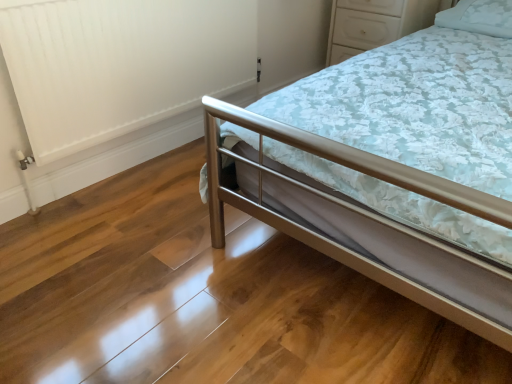
Question: Considering the relative sizes of white glossy dresser at upper right and metallic silver bed at center in the image provided, is white glossy dresser at upper right bigger than metallic silver bed at center?

Choices:
 (A) yes
 (B) no

Answer: (B)

Question: From a real-world perspective, is white glossy dresser at upper right under metallic silver bed at center?

Choices:
 (A) yes
 (B) no

Answer: (A)

Question: Is white glossy dresser at upper right not inside metallic silver bed at center?

Choices:
 (A) yes
 (B) no

Answer: (A)

Question: Is white glossy dresser at upper right aimed at metallic silver bed at center?

Choices:
 (A) yes
 (B) no

Answer: (B)

Question: Considering the relative sizes of white glossy dresser at upper right and metallic silver bed at center in the image provided, is white glossy dresser at upper right wider than metallic silver bed at center?

Choices:
 (A) yes
 (B) no

Answer: (B)

Question: Is white glossy dresser at upper right thinner than metallic silver bed at center?

Choices:
 (A) no
 (B) yes

Answer: (B)

Question: From a real-world perspective, is white matte radiator at left on metallic silver bed at center?

Choices:
 (A) no
 (B) yes

Answer: (A)

Question: Is white matte radiator at left positioned behind metallic silver bed at center?

Choices:
 (A) yes
 (B) no

Answer: (A)

Question: Considering the relative sizes of white matte radiator at left and metallic silver bed at center in the image provided, is white matte radiator at left smaller than metallic silver bed at center?

Choices:
 (A) no
 (B) yes

Answer: (B)

Question: Does white matte radiator at left have a lesser height compared to metallic silver bed at center?

Choices:
 (A) yes
 (B) no

Answer: (A)

Question: Considering the relative sizes of white matte radiator at left and metallic silver bed at center in the image provided, is white matte radiator at left bigger than metallic silver bed at center?

Choices:
 (A) yes
 (B) no

Answer: (B)

Question: Is white matte radiator at left thinner than metallic silver bed at center?

Choices:
 (A) no
 (B) yes

Answer: (B)

Question: Is white matte radiator at left next to white fabric pillow at upper right?

Choices:
 (A) no
 (B) yes

Answer: (A)